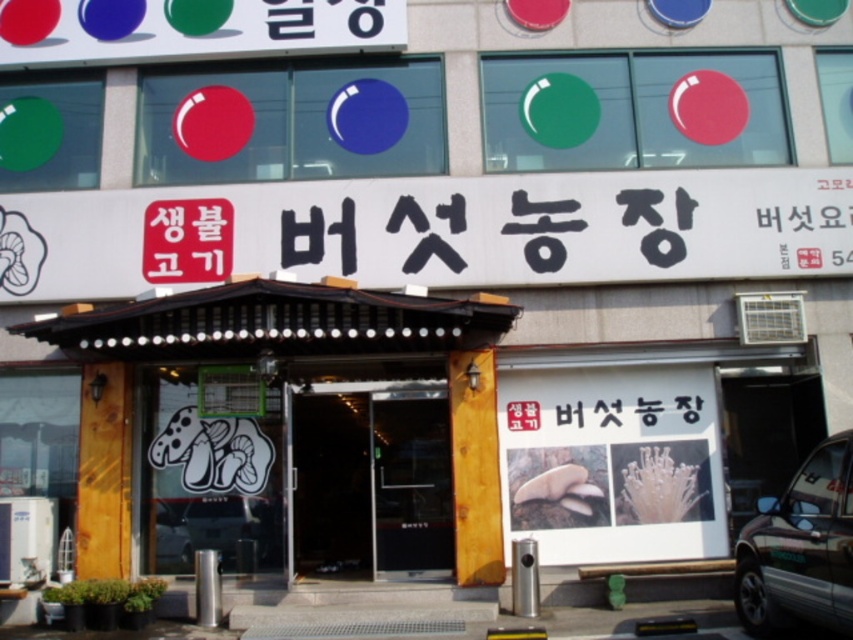
Can you confirm if transparent glass door at center is wider than metallic silver car at center?

Correct, the width of transparent glass door at center exceeds that of metallic silver car at center.

Is transparent glass door at center to the right of metallic silver car at center from the viewer's perspective?

Yes, transparent glass door at center is to the right of metallic silver car at center.

The width and height of the screenshot is (853, 640). Find the location of `transparent glass door at center`. transparent glass door at center is located at coordinates (370, 483).

Can you confirm if metallic silver suv at right is taller than red paper sign at center?

Yes, metallic silver suv at right is taller than red paper sign at center.

Between metallic silver suv at right and red paper sign at center, which one is positioned higher?

red paper sign at center is higher up.

Is point (808, 611) positioned behind point (199, 225)?

No, it is not.

You are a GUI agent. You are given a task and a screenshot of the screen. Output one action in this format:
    pyautogui.click(x=<x>, y=<y>)
    Task: Click on the metallic silver suv at right
    
    Given the screenshot: What is the action you would take?
    pyautogui.click(x=799, y=548)

From the picture: Which of these two, wooden door at center or metallic silver suv at right, stands shorter?

metallic silver suv at right is shorter.

Does wooden door at center have a greater height compared to metallic silver suv at right?

Yes.

Which is behind, point (183, 294) or point (775, 529)?

The point (183, 294) is more distant.

Find the location of a particular element. This screenshot has height=640, width=853. wooden door at center is located at coordinates (285, 433).